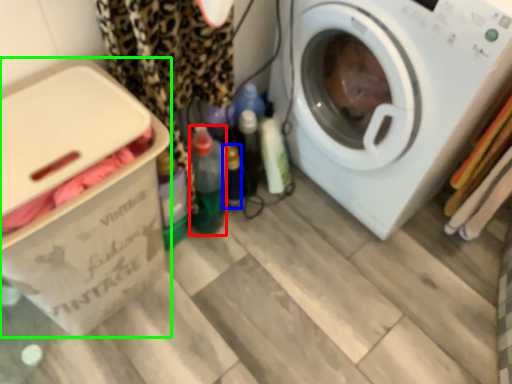
Question: Considering the real-world distances, which object is farthest from bottle (highlighted by a red box)? bottle (highlighted by a blue box) or cardboard box (highlighted by a green box)?

Choices:
 (A) bottle
 (B) cardboard box

Answer: (B)